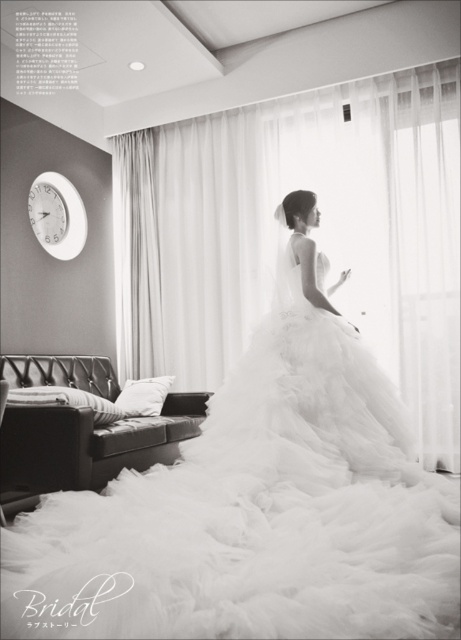
Question: Which point appears closest to the camera in this image?

Choices:
 (A) (49, 189)
 (B) (266, 611)

Answer: (B)

Question: From the image, what is the correct spatial relationship of white tulle dress at center in relation to white plastic clock at upper left?

Choices:
 (A) left
 (B) right

Answer: (B)

Question: Does white tulle dress at center have a greater width compared to white plastic clock at upper left?

Choices:
 (A) no
 (B) yes

Answer: (B)

Question: Does white tulle dress at center have a smaller size compared to white plastic clock at upper left?

Choices:
 (A) yes
 (B) no

Answer: (B)

Question: Which object appears farthest from the camera in this image?

Choices:
 (A) white plastic clock at upper left
 (B) white tulle dress at center

Answer: (A)